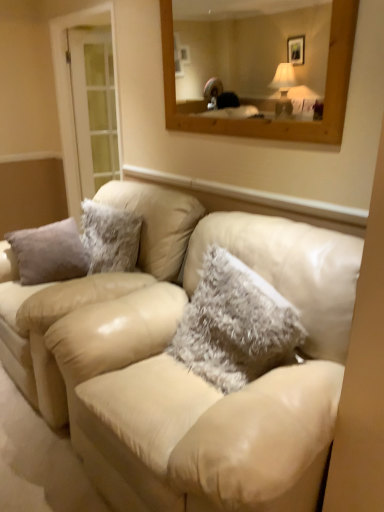
Question: From a real-world perspective, is beige leather couch at center beneath fuzzy white pillow at center?

Choices:
 (A) no
 (B) yes

Answer: (B)

Question: Is beige leather couch at center located outside fuzzy white pillow at center?

Choices:
 (A) yes
 (B) no

Answer: (A)

Question: Would you say fuzzy white pillow at center is part of beige leather couch at center's contents?

Choices:
 (A) no
 (B) yes

Answer: (B)

Question: Is there a large distance between beige leather couch at center and fuzzy white pillow at center?

Choices:
 (A) yes
 (B) no

Answer: (B)

Question: Considering the relative positions of beige leather couch at center and fuzzy white pillow at center in the image provided, is beige leather couch at center to the right of fuzzy white pillow at center from the viewer's perspective?

Choices:
 (A) yes
 (B) no

Answer: (B)

Question: Is clear glass door at left wider or thinner than beige leather couch at center?

Choices:
 (A) wide
 (B) thin

Answer: (B)

Question: From a real-world perspective, is clear glass door at left physically located above or below beige leather couch at center?

Choices:
 (A) above
 (B) below

Answer: (A)

Question: Considering the positions of clear glass door at left and beige leather couch at center in the image, is clear glass door at left taller or shorter than beige leather couch at center?

Choices:
 (A) short
 (B) tall

Answer: (B)

Question: Based on their sizes in the image, would you say clear glass door at left is bigger or smaller than beige leather couch at center?

Choices:
 (A) big
 (B) small

Answer: (B)

Question: Is point (61, 55) positioned closer to the camera than point (36, 362)?

Choices:
 (A) closer
 (B) farther

Answer: (B)

Question: From the image's perspective, is clear glass door at left above or below beige leather couch at center?

Choices:
 (A) below
 (B) above

Answer: (B)

Question: Considering the positions of clear glass door at left and beige leather couch at center in the image, is clear glass door at left wider or thinner than beige leather couch at center?

Choices:
 (A) wide
 (B) thin

Answer: (B)

Question: From a real-world perspective, is clear glass door at left above or below beige leather couch at center?

Choices:
 (A) above
 (B) below

Answer: (A)

Question: Does point (173, 224) appear closer or farther from the camera than point (256, 351)?

Choices:
 (A) closer
 (B) farther

Answer: (B)

Question: Is beige leather couch at center bigger or smaller than fuzzy white pillow at center?

Choices:
 (A) big
 (B) small

Answer: (A)